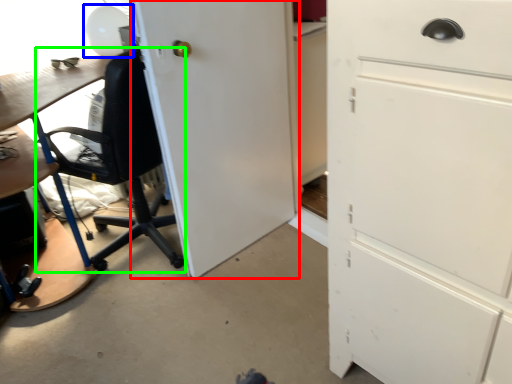
Question: Based on their relative distances, which object is nearer to door (highlighted by a red box)? Choose from table lamp (highlighted by a blue box) and chair (highlighted by a green box).

Choices:
 (A) table lamp
 (B) chair

Answer: (B)